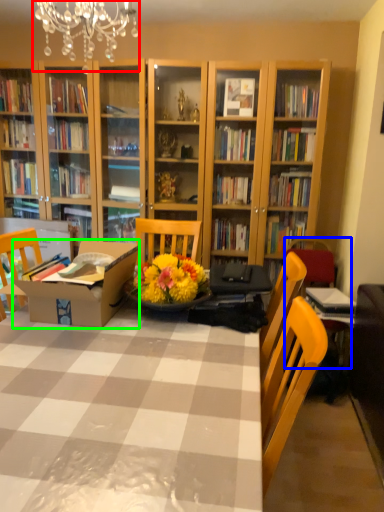
Question: Considering the real-world distances, which object is farthest from light fixture (highlighted by a red box)? armchair (highlighted by a blue box) or cardboard box (highlighted by a green box)?

Choices:
 (A) armchair
 (B) cardboard box

Answer: (A)